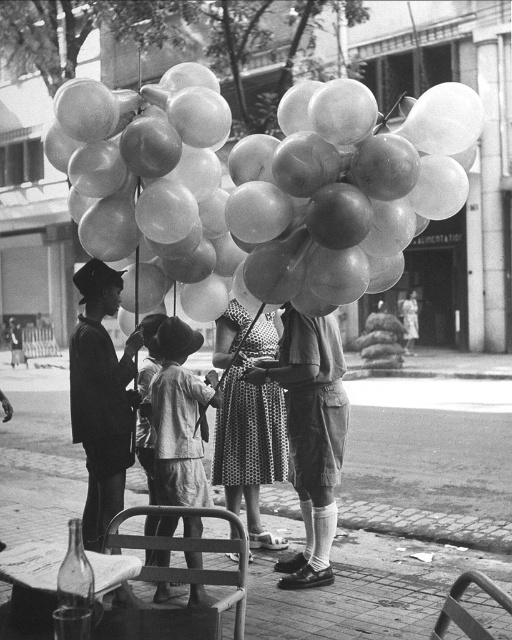
You are a photographer trying to capture the entire scene in one shot. Given that your camera has a limited field of view, which object between the translucent rubber balloons at center and the polka dot dress at center will require you to adjust your framing more to include it fully?

The translucent rubber balloons at center will require more adjustment since their width is greater than the polka dot dress at center.

You are a customer looking to buy balloons from the vendor. You see the translucent rubber balloons at center and the matte khaki shorts at center. Which item is located more to the left?

The translucent rubber balloons at center is positioned on the left side of matte khaki shorts at center, so it is more to the left.

From the picture: You are a photographer trying to capture a photo of both the dark suit at center and the polka dot dress at center in the scene. Since you want to ensure both are fully visible in the frame, which clothing item should you focus on to avoid cropping due to their size difference?

The dark suit at center has a lesser width compared to the polka dot dress at center, so you should focus on the polka dot dress at center to ensure it fits within the frame without cropping.